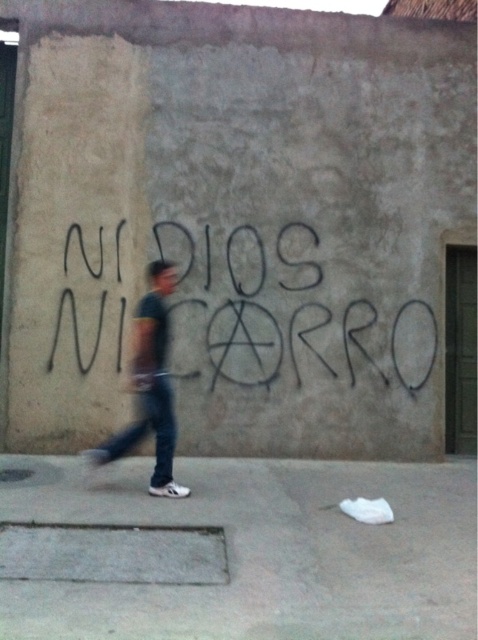
You are a delivery robot that is 1.2 meters tall. You are on the gray concrete pavement at lower center and need to reach a delivery point near the dark blue jeans at center. Can you safely pass under the graffiti wall without hitting your head?

The gray concrete pavement at lower center is 1.45 meters away from dark blue jeans at center. Since the distance between them is 1.45 meters and the robot is 1.2 meters tall, the robot can safely pass under the graffiti wall without hitting its head as the wall height is not mentioned but the distance allows clearance.

You are standing on the sidewalk in front of the graffiti wall. There are two points marked on the wall. Which of the two points, point 1 at coordinates (426,518) or point 2 at coordinates (187,244), is closer to you?

Point 1 at coordinates (426,518) is closer to the viewer than point 2 at coordinates (187,244).